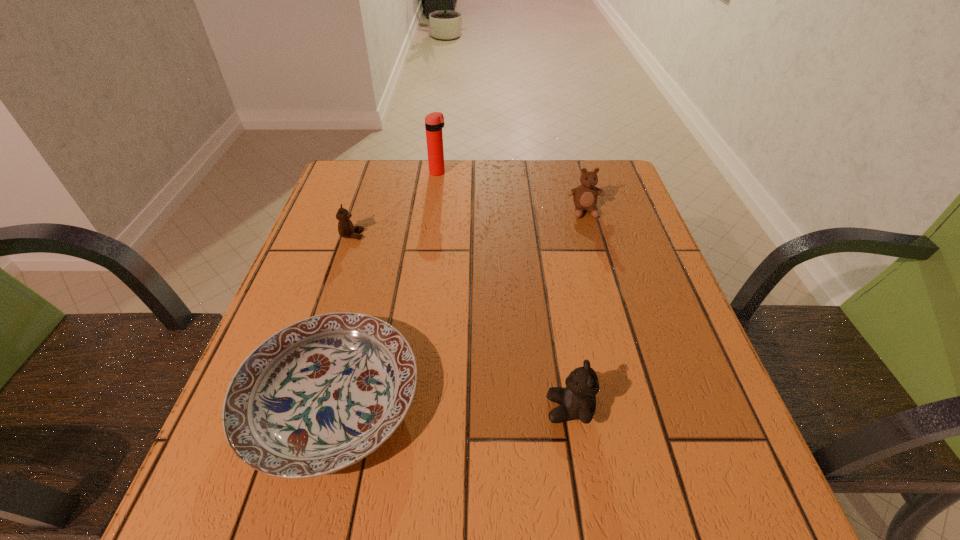
This screenshot has width=960, height=540. What are the coordinates of `thermos bottle` in the screenshot? It's located at (434, 122).

Locate an element on the screen. Image resolution: width=960 pixels, height=540 pixels. the tallest object is located at coordinates (434, 122).

The image size is (960, 540). What are the coordinates of `the farthest teddy bear` in the screenshot? It's located at (585, 196).

At what (x,y) coordinates should I click in order to perform the action: click on the rightmost teddy bear. Please return your answer as a coordinate pair (x, y). Looking at the image, I should click on (585, 196).

Locate an element on the screen. the nearest teddy bear is located at coordinates (577, 401).

At what (x,y) coordinates should I click in order to perform the action: click on the second object from right to left. Please return your answer as a coordinate pair (x, y). Looking at the image, I should click on (577, 401).

Locate an element on the screen. the leftmost teddy bear is located at coordinates (346, 229).

You are a GUI agent. You are given a task and a screenshot of the screen. Output one action in this format:
    pyautogui.click(x=<x>, y=<y>)
    Task: Click on the shortest teddy bear
    Image resolution: width=960 pixels, height=540 pixels.
    Given the screenshot: What is the action you would take?
    pyautogui.click(x=346, y=229)

You are a GUI agent. You are given a task and a screenshot of the screen. Output one action in this format:
    pyautogui.click(x=<x>, y=<y>)
    Task: Click on the shortest object
    The height and width of the screenshot is (540, 960).
    Given the screenshot: What is the action you would take?
    pyautogui.click(x=319, y=395)

Where is `blank area located 0.320m on the front of the tallest object`? blank area located 0.320m on the front of the tallest object is located at coordinates coord(428,248).